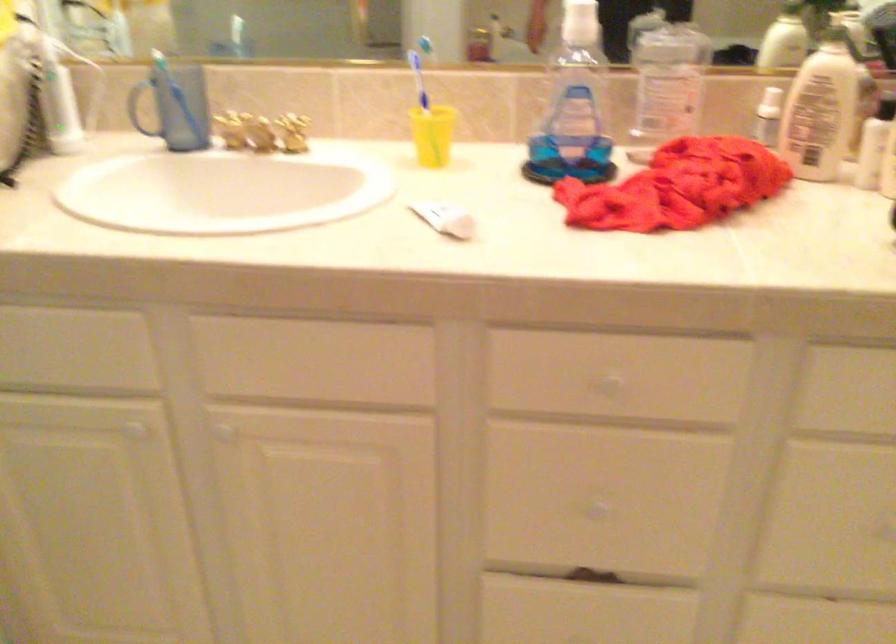
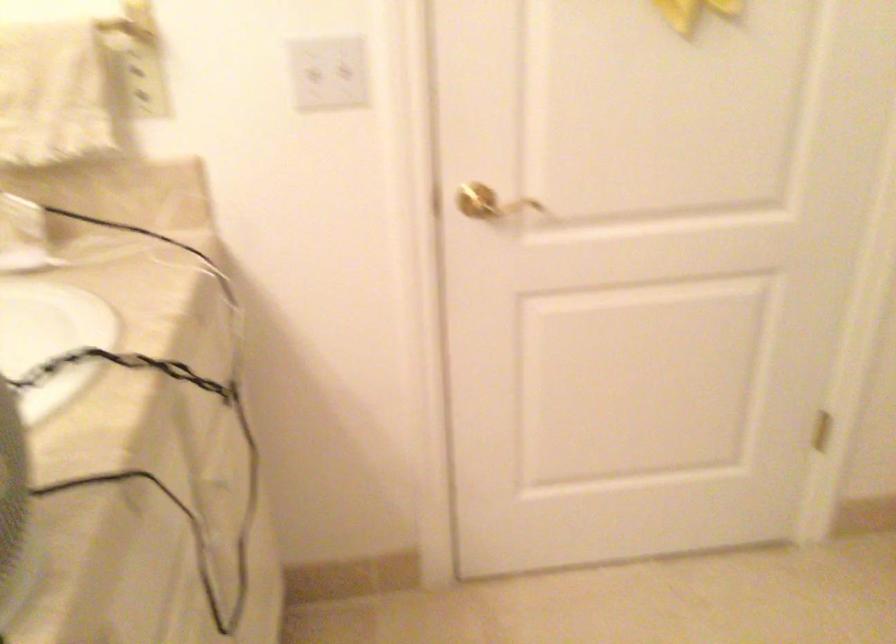
The first image is from the beginning of the video and the second image is from the end. How did the camera likely rotate when shooting the video?

The camera rotated toward right-down.